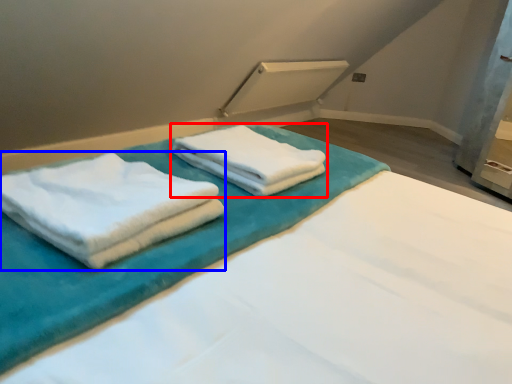
Question: Which object is further to the camera taking this photo, towel (highlighted by a red box) or towel (highlighted by a blue box)?

Choices:
 (A) towel
 (B) towel

Answer: (A)